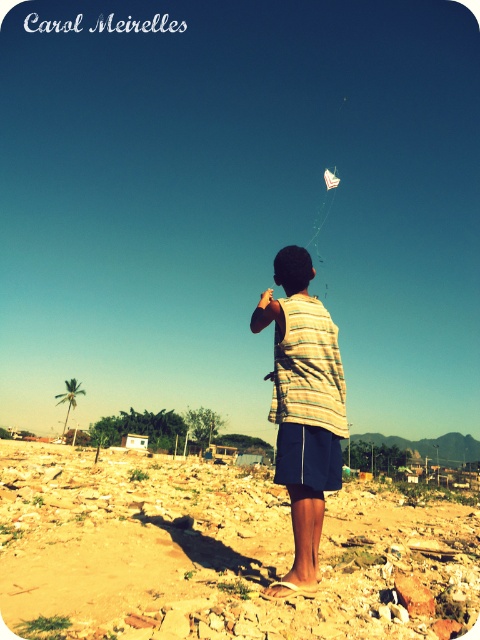
You are a photographer trying to capture the white paper kite at upper center and the brown rocky dirt at center in a single shot. Which object will take up more of the frame?

The white paper kite at upper center takes up more space in the frame than the brown rocky dirt at center because it occupies more space according to the description.

You are a photographer trying to capture the striped fabric shirt at center and the brown rocky dirt at center in the same frame. Since you can only adjust your camera to focus on one object, which one should you focus on to ensure both are in the frame?

The brown rocky dirt at center is positioned on the left side of striped fabric shirt at center, so focusing on the striped fabric shirt at center would ensure both are in the frame since the shirt is centered and the dirt is adjacent to it on the left.

You are a bird flying over the scene. You see the brown rocky dirt at center and the white paper kite at upper center. Which object is located below the other?

The brown rocky dirt at center is positioned under the white paper kite at upper center, so the brown rocky dirt at center is below the white paper kite at upper center.